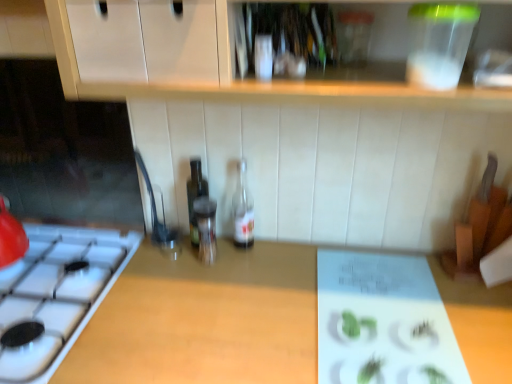
Where is `free space to the left of transparent glass bottle at center, the 2th bottle positioned from the right`? free space to the left of transparent glass bottle at center, the 2th bottle positioned from the right is located at coordinates (156, 264).